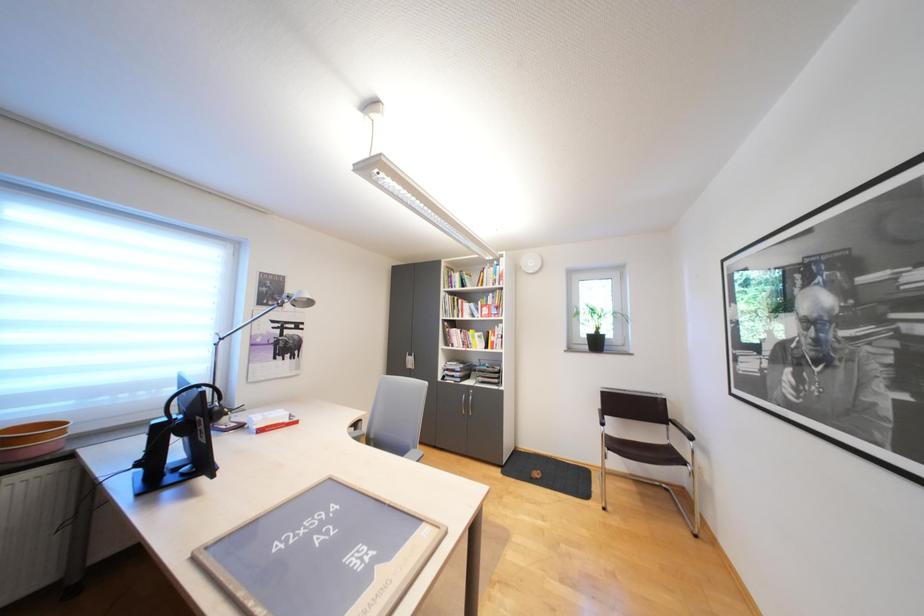
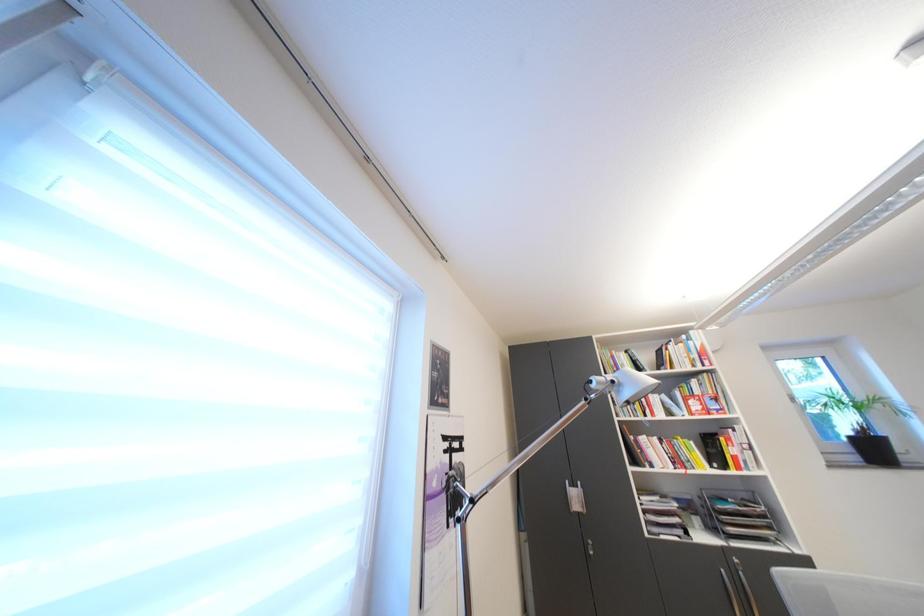
What movement of the cameraman would produce the second image?

The movement direction of the cameraman is left, forward.